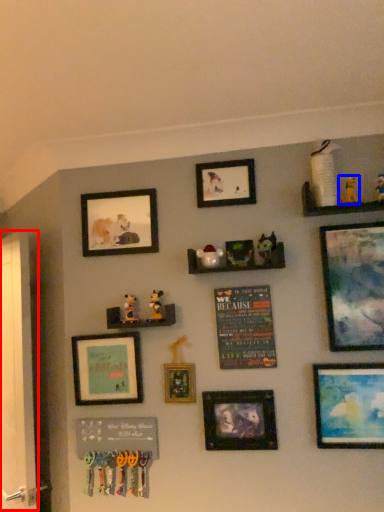
Question: Which of the following is the closest to the observer, screen door (highlighted by a red box) or toy (highlighted by a blue box)?

Choices:
 (A) screen door
 (B) toy

Answer: (B)